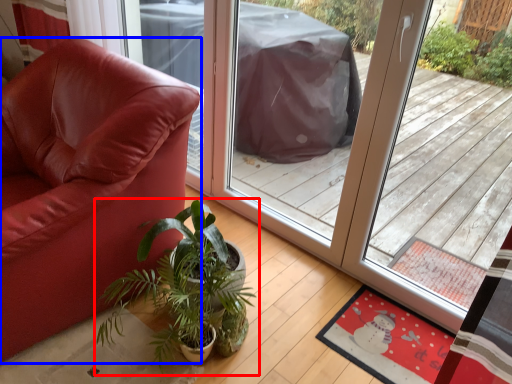
Question: Which object appears farthest to the camera in this image, houseplant (highlighted by a red box) or chair (highlighted by a blue box)?

Choices:
 (A) houseplant
 (B) chair

Answer: (A)